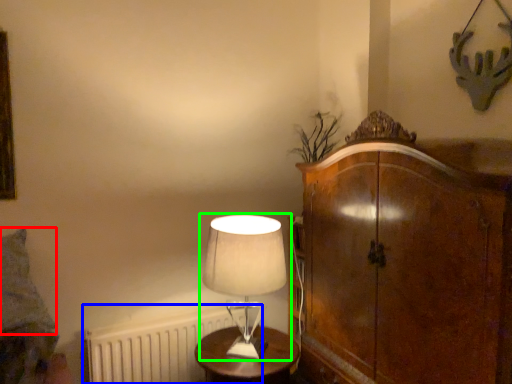
Question: Which object is positioned farthest from pillow (highlighted by a red box)? Select from radiator (highlighted by a blue box) and lamp (highlighted by a green box).

Choices:
 (A) radiator
 (B) lamp

Answer: (B)